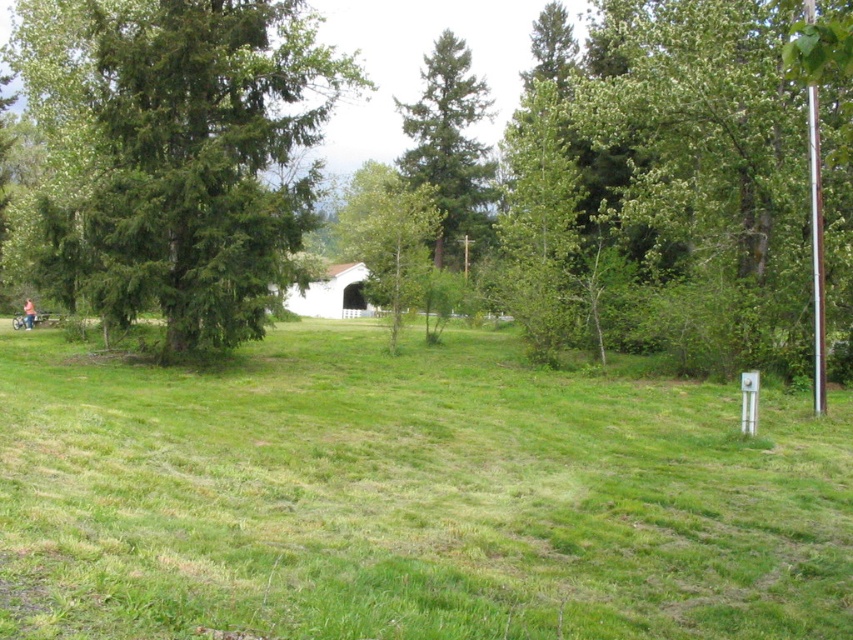
Question: Which point is closer to the camera?

Choices:
 (A) green matte tree at center
 (B) white painted wood hut at center

Answer: (B)

Question: Considering the real-world distances, which object is closest to the light brown wooden bench at lower left?

Choices:
 (A) white painted wood hut at center
 (B) green matte tree at left

Answer: (B)

Question: Does green grassy field at center appear over green matte tree at left?

Choices:
 (A) no
 (B) yes

Answer: (A)

Question: Which object is the farthest from the light brown wooden bench at lower left?

Choices:
 (A) green grassy field at center
 (B) green leafy tree at right
 (C) green matte tree at left
 (D) white painted wood hut at center

Answer: (A)

Question: Can you confirm if green grassy field at center is positioned to the right of green leafy tree at right?

Choices:
 (A) no
 (B) yes

Answer: (A)

Question: From the image, what is the correct spatial relationship of white painted wood hut at center in relation to light brown wooden bench at lower left?

Choices:
 (A) right
 (B) left

Answer: (A)